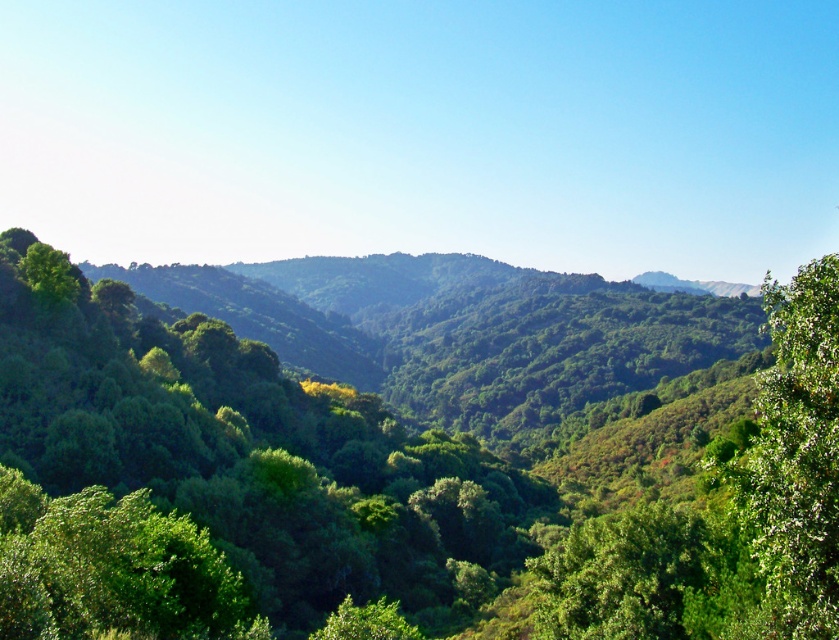
Is point (392, 513) farther from viewer compared to point (821, 300)?

Yes, it is behind point (821, 300).

Does green leafy tree at center have a lesser width compared to green leafy tree at right?

In fact, green leafy tree at center might be wider than green leafy tree at right.

The height and width of the screenshot is (640, 839). What do you see at coordinates (378, 486) in the screenshot?
I see `green leafy tree at center` at bounding box center [378, 486].

At what (x,y) coordinates should I click in order to perform the action: click on green leafy tree at center. Please return your answer as a coordinate pair (x, y). This screenshot has height=640, width=839. Looking at the image, I should click on (378, 486).